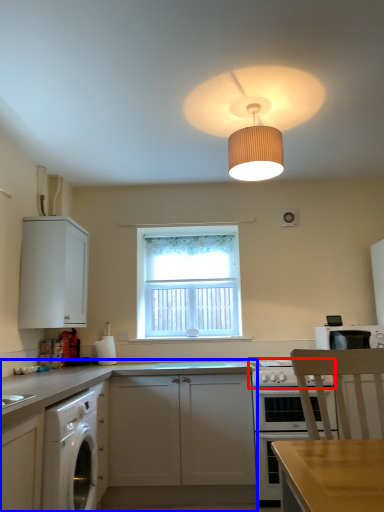
Question: Among these objects, which one is nearest to the camera, gas stove (highlighted by a red box) or cabinetry (highlighted by a blue box)?

Choices:
 (A) gas stove
 (B) cabinetry

Answer: (B)